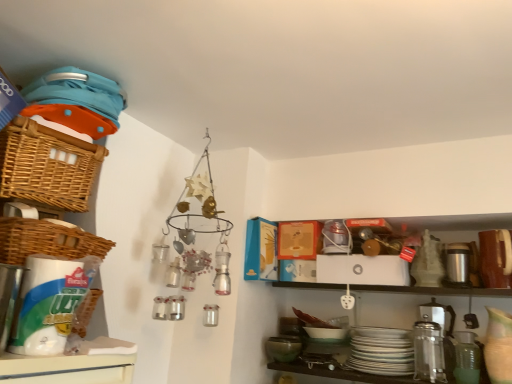
Question: Can you confirm if silver metallic thermos at right is taller than green matte mixing bowl at lower center?

Choices:
 (A) yes
 (B) no

Answer: (A)

Question: Is green matte mixing bowl at lower center completely or partially inside silver metallic thermos at right?

Choices:
 (A) no
 (B) yes

Answer: (A)

Question: Is there a large distance between silver metallic thermos at right and green matte mixing bowl at lower center?

Choices:
 (A) yes
 (B) no

Answer: (B)

Question: From the image's perspective, is silver metallic thermos at right located above green matte mixing bowl at lower center?

Choices:
 (A) no
 (B) yes

Answer: (B)

Question: Is silver metallic thermos at right positioned beyond the bounds of green matte mixing bowl at lower center?

Choices:
 (A) no
 (B) yes

Answer: (B)

Question: Considering the relative sizes of silver metallic thermos at right and green matte mixing bowl at lower center in the image provided, is silver metallic thermos at right smaller than green matte mixing bowl at lower center?

Choices:
 (A) yes
 (B) no

Answer: (B)

Question: Is silver metallic thermos at right outside of woven brown basket at left, the second basket positioned from the top?

Choices:
 (A) no
 (B) yes

Answer: (B)

Question: Is the position of silver metallic thermos at right less distant than that of woven brown basket at left, arranged as the 1th basket when ordered from the bottom?

Choices:
 (A) yes
 (B) no

Answer: (B)

Question: Does silver metallic thermos at right have a greater width compared to woven brown basket at left, arranged as the 1th basket when ordered from the bottom?

Choices:
 (A) yes
 (B) no

Answer: (B)

Question: From the image's perspective, would you say silver metallic thermos at right is positioned over woven brown basket at left, the second basket positioned from the top?

Choices:
 (A) no
 (B) yes

Answer: (A)

Question: From the image's perspective, would you say silver metallic thermos at right is shown under woven brown basket at left, the second basket positioned from the top?

Choices:
 (A) yes
 (B) no

Answer: (A)

Question: Is the position of silver metallic thermos at right more distant than that of woven brown basket at left, arranged as the 1th basket when ordered from the bottom?

Choices:
 (A) no
 (B) yes

Answer: (B)

Question: Is the depth of woven brown basket at left, the second basket positioned from the top, greater than that of woven brown basket at upper left, the 1th basket when ordered from top to bottom?

Choices:
 (A) no
 (B) yes

Answer: (A)